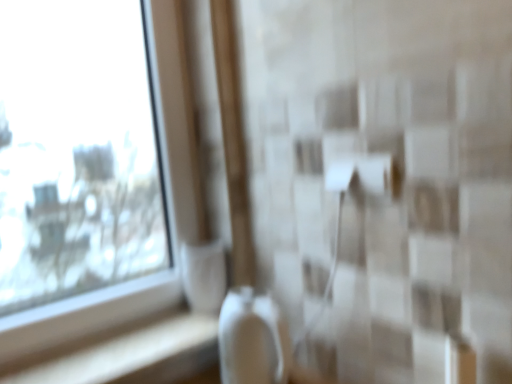
Question: From the image's perspective, is white glossy ledge at lower left beneath transparent glass window at upper left?

Choices:
 (A) no
 (B) yes

Answer: (B)

Question: Is white glossy ledge at lower left turned away from transparent glass window at upper left?

Choices:
 (A) no
 (B) yes

Answer: (B)

Question: Is white glossy ledge at lower left facing towards transparent glass window at upper left?

Choices:
 (A) no
 (B) yes

Answer: (A)

Question: From the image's perspective, does white glossy ledge at lower left appear higher than transparent glass window at upper left?

Choices:
 (A) no
 (B) yes

Answer: (A)

Question: Does white glossy ledge at lower left appear on the right side of transparent glass window at upper left?

Choices:
 (A) yes
 (B) no

Answer: (A)

Question: From a real-world perspective, is white glossy ledge at lower left positioned under transparent glass window at upper left based on gravity?

Choices:
 (A) yes
 (B) no

Answer: (A)

Question: Is transparent glass window at upper left positioned with its back to white glossy ledge at lower left?

Choices:
 (A) yes
 (B) no

Answer: (B)

Question: Are transparent glass window at upper left and white glossy ledge at lower left beside each other?

Choices:
 (A) no
 (B) yes

Answer: (A)

Question: Can you confirm if transparent glass window at upper left is bigger than white glossy ledge at lower left?

Choices:
 (A) yes
 (B) no

Answer: (A)

Question: Is transparent glass window at upper left further to camera compared to white glossy ledge at lower left?

Choices:
 (A) no
 (B) yes

Answer: (A)

Question: Is transparent glass window at upper left wider than white glossy ledge at lower left?

Choices:
 (A) no
 (B) yes

Answer: (A)

Question: Considering the relative sizes of transparent glass window at upper left and white glossy ledge at lower left in the image provided, is transparent glass window at upper left shorter than white glossy ledge at lower left?

Choices:
 (A) no
 (B) yes

Answer: (A)

Question: In the image, is white glossy ledge at lower left positioned in front of or behind transparent glass window at upper left?

Choices:
 (A) front
 (B) behind

Answer: (B)